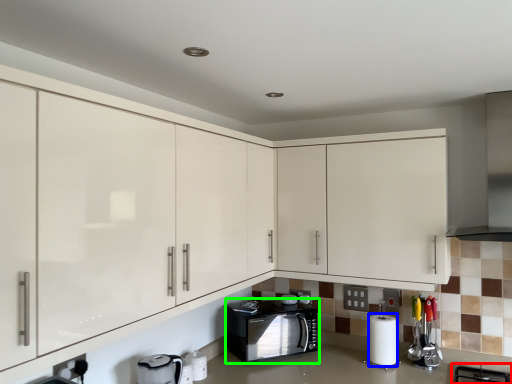
Question: Estimate the real-world distances between objects in this image. Which object is closer to gas stove (highlighted by a red box), paper towel (highlighted by a blue box) or home appliance (highlighted by a green box)?

Choices:
 (A) paper towel
 (B) home appliance

Answer: (A)